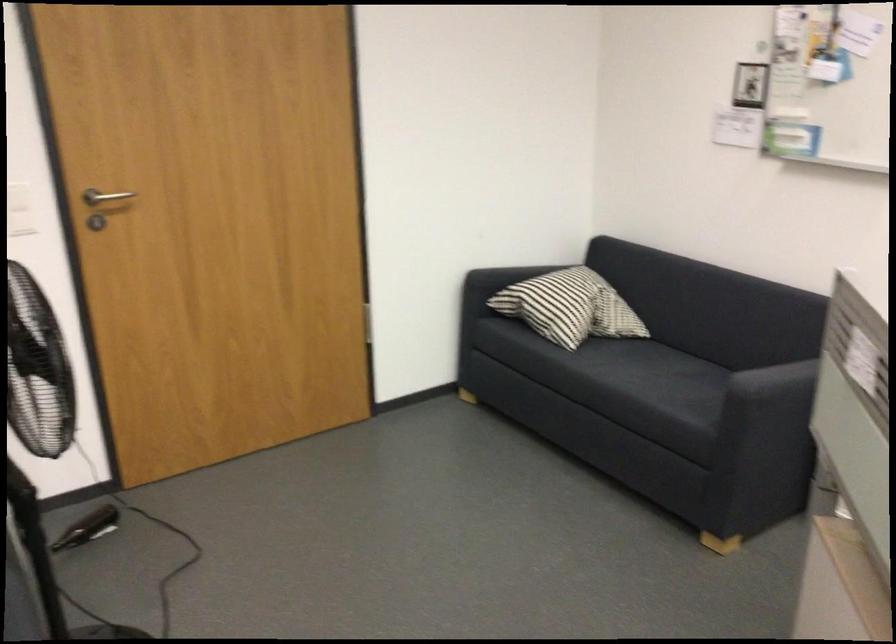
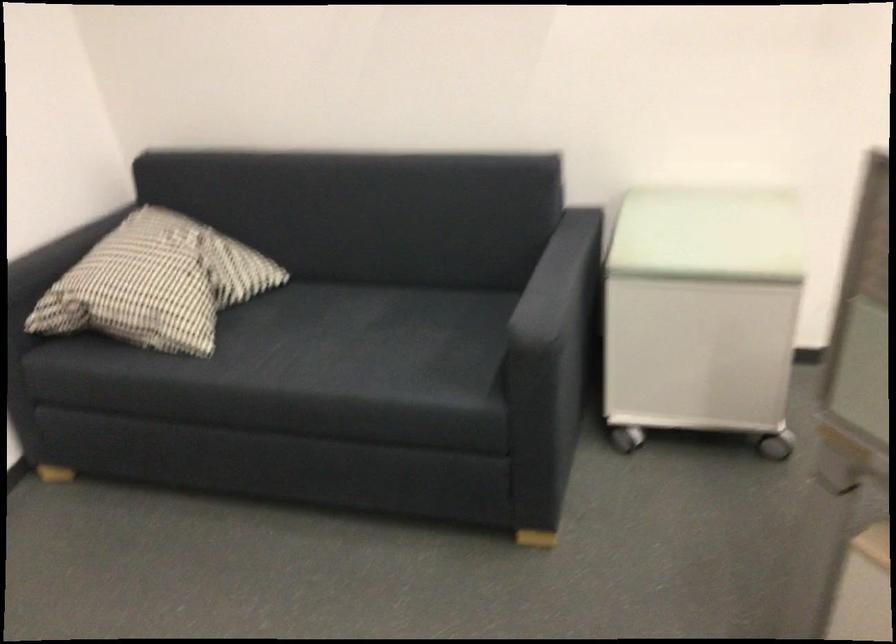
Find the pixel in the second image that matches point (700, 381) in the first image.

(410, 327)